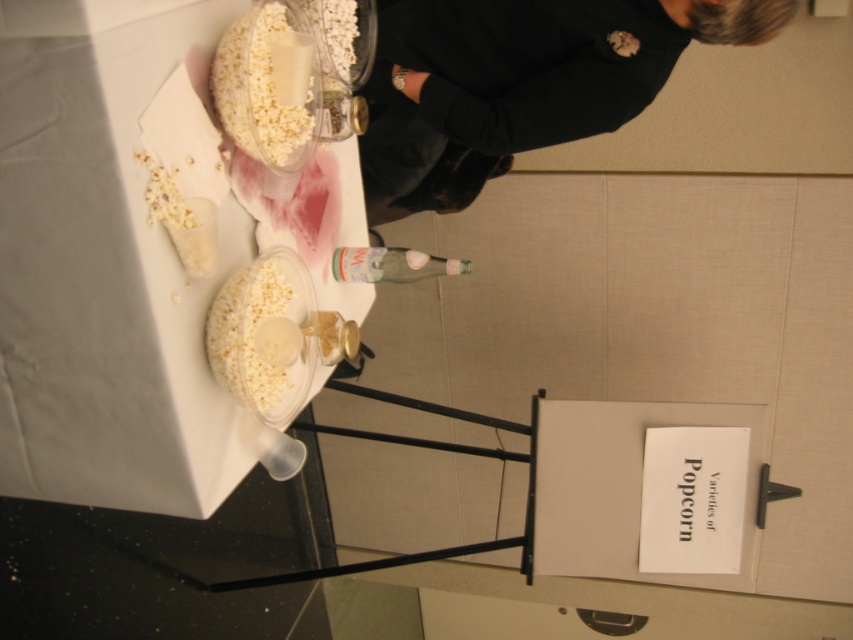
How distant is black fabric at upper right from white fluffy popcorn at upper center?

They are 15.65 inches apart.

Based on the photo, between black fabric at upper right and white fluffy popcorn at upper center, which one appears on the right side from the viewer's perspective?

Positioned to the right is black fabric at upper right.

Which is behind, point (543, 112) or point (216, 65)?

Positioned behind is point (543, 112).

Where is `black fabric at upper right`? black fabric at upper right is located at coordinates point(519,83).

Who is positioned more to the left, black fabric at upper right or white fluffy popcorn at center?

white fluffy popcorn at center

Image resolution: width=853 pixels, height=640 pixels. Find the location of `black fabric at upper right`. black fabric at upper right is located at coordinates (519, 83).

Between white fluffy popcorn at upper center and white fluffy popcorn at center, which one appears on the right side from the viewer's perspective?

white fluffy popcorn at upper center

From the picture: How much distance is there between white fluffy popcorn at upper center and white fluffy popcorn at center?

white fluffy popcorn at upper center and white fluffy popcorn at center are 12.39 inches apart from each other.

Is point (287, 60) positioned before point (241, 268)?

Yes.

I want to click on white fluffy popcorn at upper center, so (x=287, y=77).